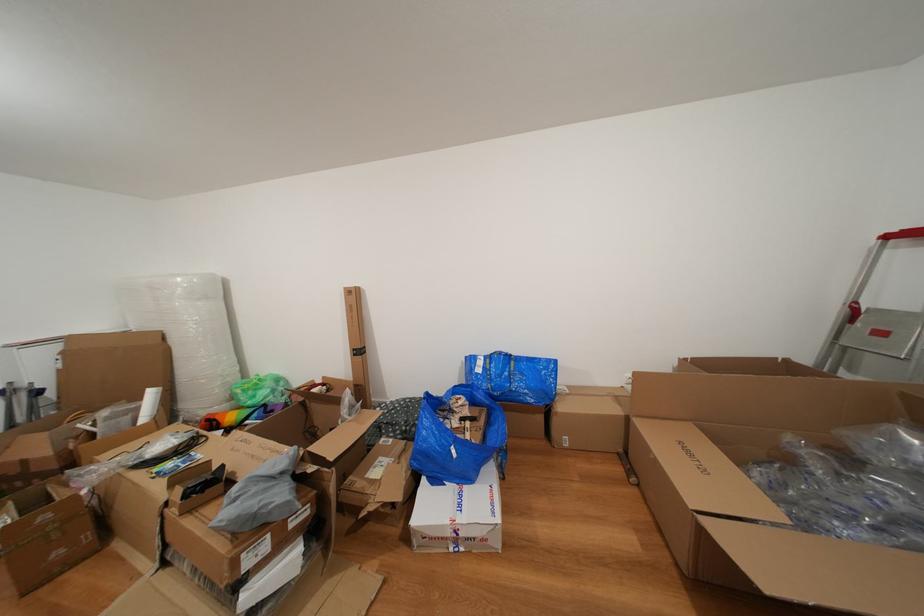
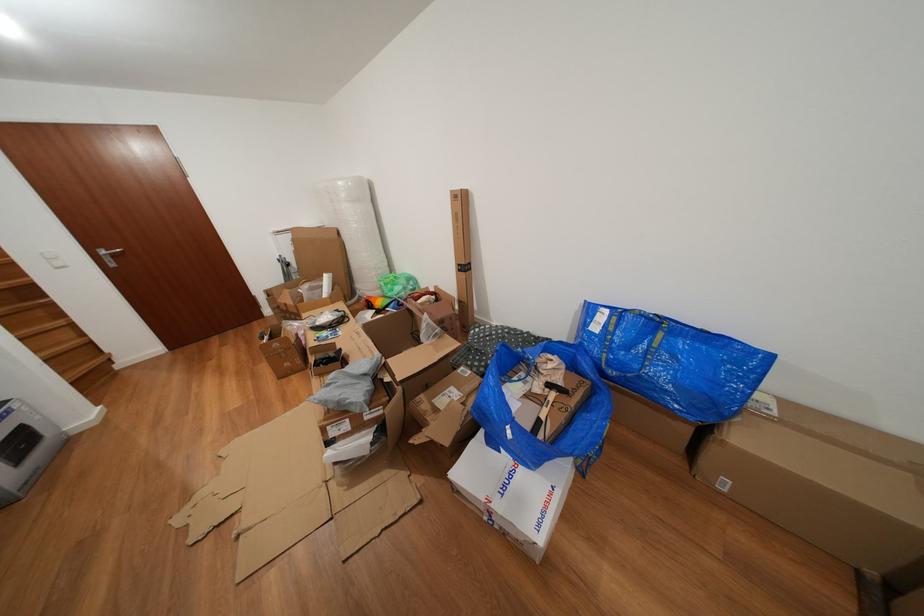
Where in the second image is the point corresponding to point (468, 511) from the first image?

(513, 493)